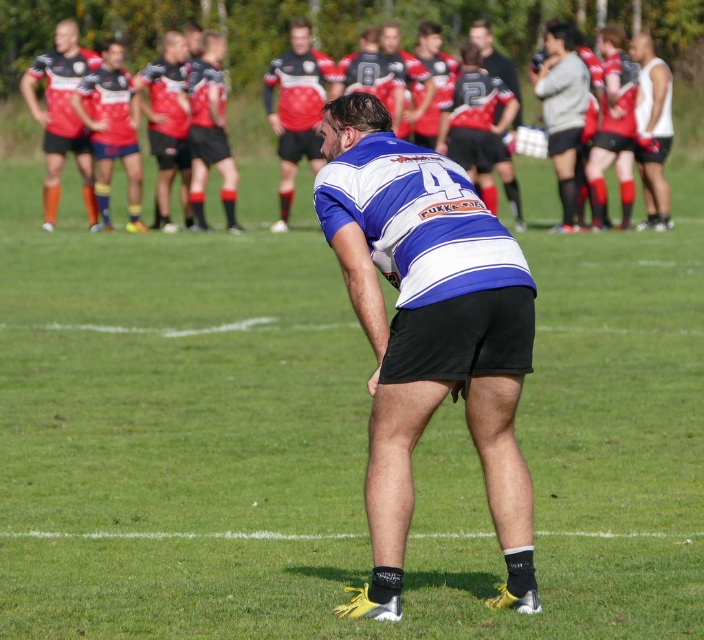
You are a sports analyst reviewing the rugby match. You notice two jerseys at the center of the field, the matte black jersey at center and the matte blue jersey at center. Which one appears narrower?

The matte black jersey at center has a lesser width compared to the matte blue jersey at center, so it appears narrower.